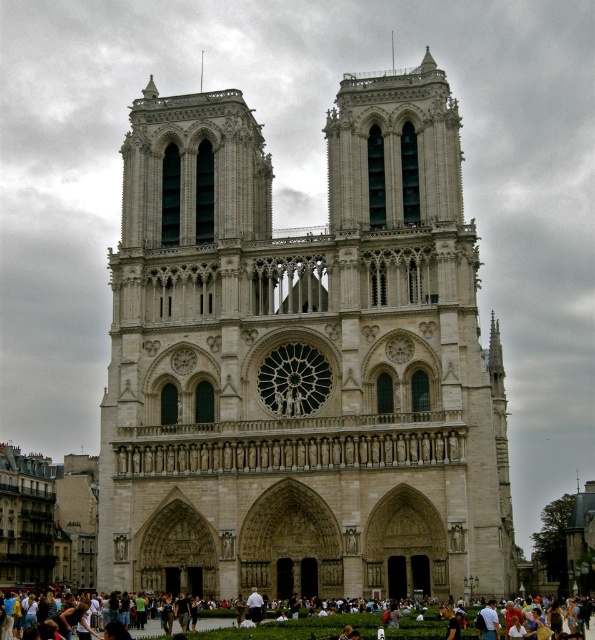
Based on the photo, you are a tourist standing in front of the Notre Dame Cathedral. You notice a light brown leather bag at lower center and the white stone church at center. Which object is taller?

The white stone church at center is taller than the light brown leather bag at lower center according to the description.